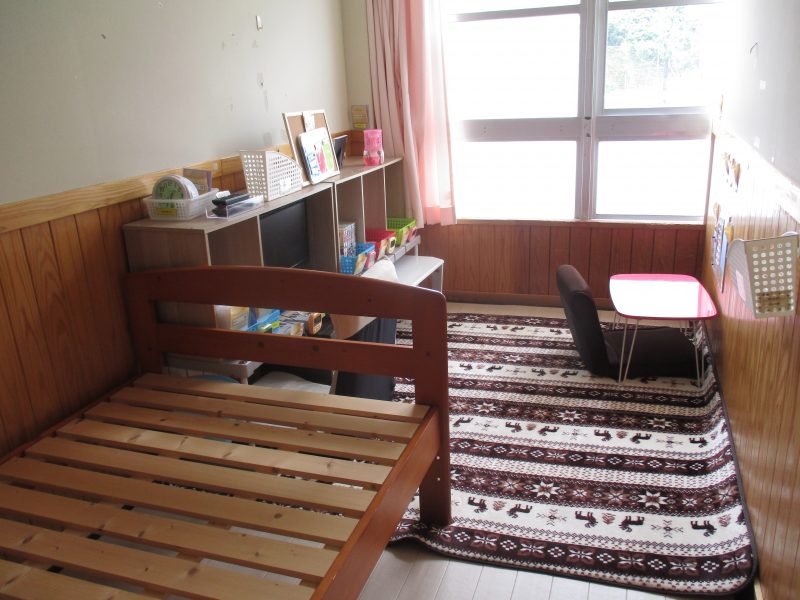
Where is `brown paneling`? This screenshot has height=600, width=800. brown paneling is located at coordinates (514, 266), (74, 282).